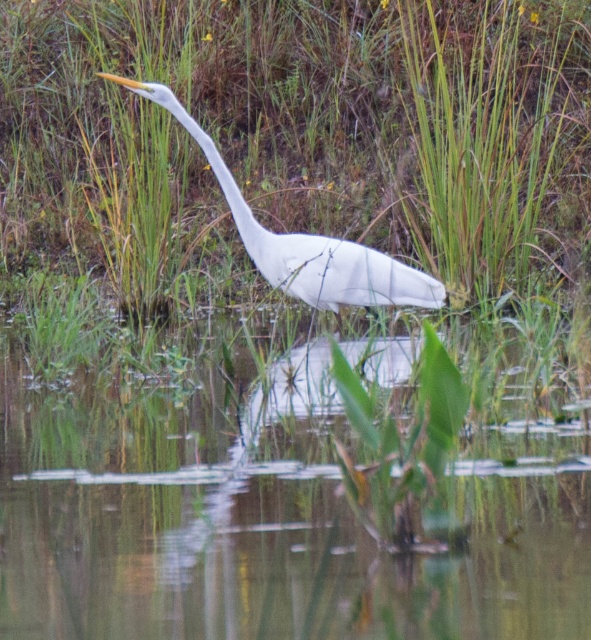
Question: Is transparent plastic water at center positioned at the back of white smooth heron at center?

Choices:
 (A) no
 (B) yes

Answer: (A)

Question: Does transparent plastic water at center have a lesser width compared to white smooth heron at center?

Choices:
 (A) no
 (B) yes

Answer: (A)

Question: Which object appears closest to the camera in this image?

Choices:
 (A) white smooth heron at center
 (B) transparent plastic water at center
 (C) green grass at center

Answer: (B)

Question: Which object is the farthest from the transparent plastic water at center?

Choices:
 (A) green grass at center
 (B) white smooth heron at center

Answer: (A)

Question: Which object is the closest to the white smooth heron at center?

Choices:
 (A) green grass at center
 (B) transparent plastic water at center

Answer: (B)

Question: Can you confirm if green grass at center is positioned to the left of transparent plastic water at center?

Choices:
 (A) no
 (B) yes

Answer: (B)